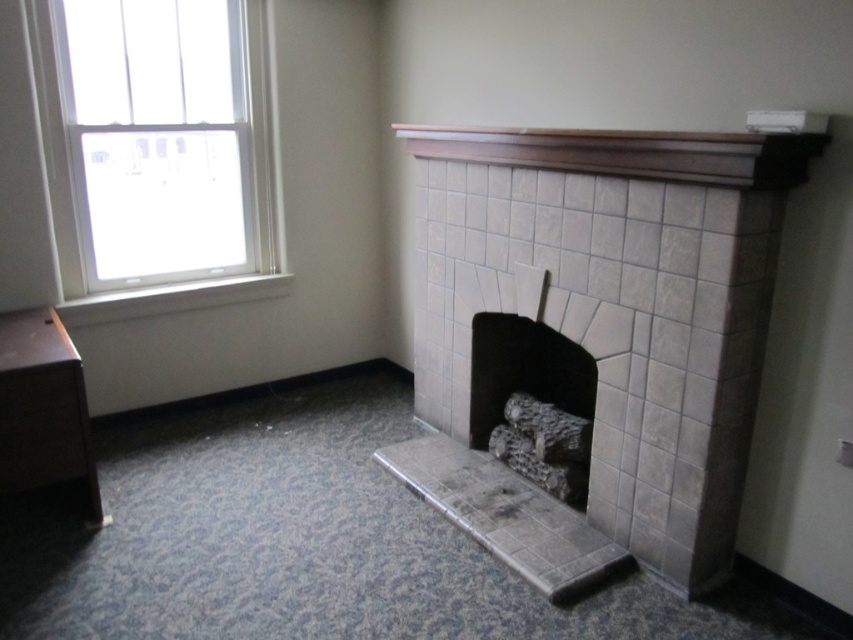
Who is taller, gray tile fireplace at center or brown wood mantle at upper center?

gray tile fireplace at center is taller.

Based on the photo, does gray tile fireplace at center have a larger size compared to brown wood mantle at upper center?

Yes, gray tile fireplace at center is bigger than brown wood mantle at upper center.

Is point (679, 184) behind point (514, 140)?

No, (679, 184) is in front of (514, 140).

Where is `gray tile fireplace at center`? gray tile fireplace at center is located at coordinates (596, 333).

Does gray tile fireplace at center come behind white glass window at upper left?

No, gray tile fireplace at center is closer to the viewer.

Between gray tile fireplace at center and white glass window at upper left, which one has less height?

white glass window at upper left is shorter.

Which is in front, point (697, 371) or point (225, 26)?

Positioned in front is point (697, 371).

Find the location of `gray tile fireplace at center`. gray tile fireplace at center is located at coordinates (596, 333).

Is white glass window at upper left taller than brown wood mantle at upper center?

Yes.

Can you confirm if white glass window at upper left is positioned above brown wood mantle at upper center?

Indeed, white glass window at upper left is positioned over brown wood mantle at upper center.

Is point (165, 148) farther from camera compared to point (664, 134)?

Yes, it is behind point (664, 134).

This screenshot has width=853, height=640. In order to click on white glass window at upper left in this screenshot , I will do `click(158, 152)`.